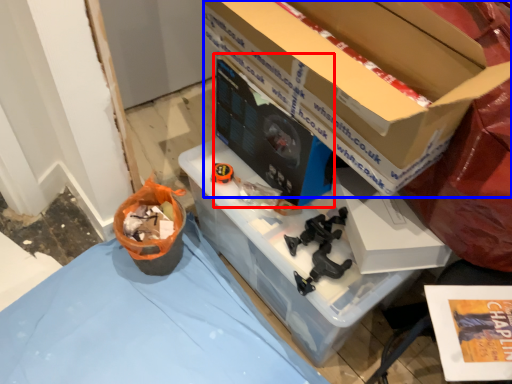
Question: Which of the following is the farthest to the observer, desktop computer (highlighted by a red box) or box (highlighted by a blue box)?

Choices:
 (A) desktop computer
 (B) box

Answer: (A)